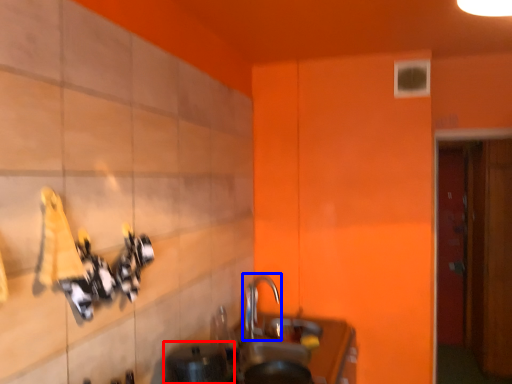
Question: Which of the following is the closest to the observer, appliance (highlighted by a red box) or tap (highlighted by a blue box)?

Choices:
 (A) appliance
 (B) tap

Answer: (A)